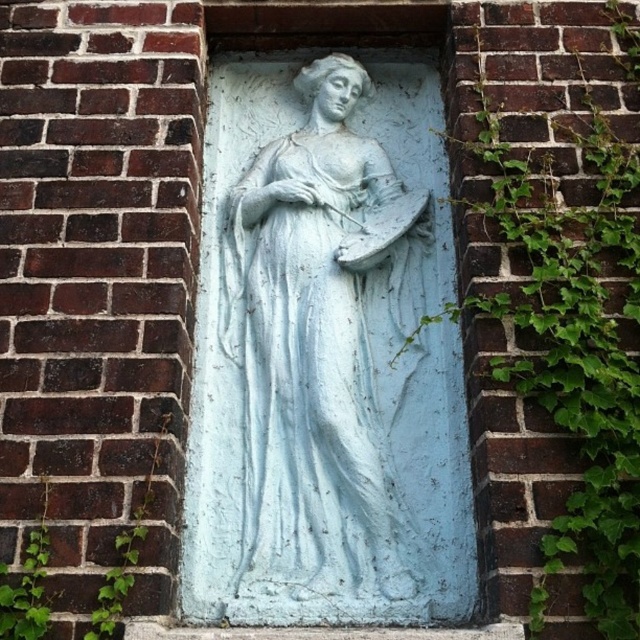
You are an art conservator examining the relief sculpture of a woman in the brick wall. You notice two points marked on the relief. The first point is at coordinates point (582, 42) and the second point is at point (260, 170). From your vantage point, which point appears closer to you?

Point (582, 42) is in front of point (260, 170), so it appears closer to you.

You are an art conservator examining the relief sculpture. You notice the green leafy ivy at right and the white stone sculpture at center. Which object is positioned higher in the scene?

The green leafy ivy at right is above the white stone sculpture at center, so it is positioned higher in the scene.